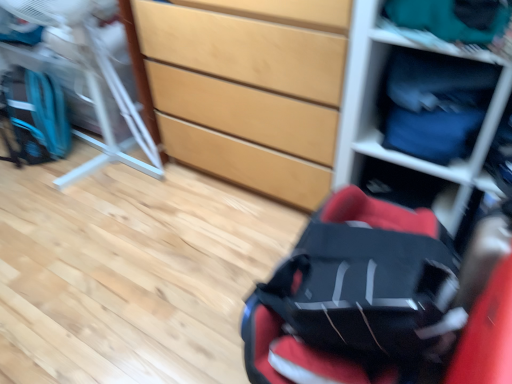
What is the approximate height of matte wood chest of drawers at center?

The height of matte wood chest of drawers at center is 84.53 centimeters.

Looking at this image, what is the approximate height of blue fabric drawer at upper right?

blue fabric drawer at upper right is 11.70 inches in height.

This screenshot has width=512, height=384. What do you see at coordinates (353, 296) in the screenshot? I see `red fabric baby carriage at center` at bounding box center [353, 296].

At what (x,y) coordinates should I click in order to perform the action: click on matte wood chest of drawers at center. Please return your answer as a coordinate pair (x, y). The image size is (512, 384). Looking at the image, I should click on (248, 92).

Considering the points (21, 12) and (351, 191), which point is behind, point (21, 12) or point (351, 191)?

The point (21, 12) is farther.

Is metallic silver folding chair at left with red fabric baby carriage at center?

No, metallic silver folding chair at left is not touching red fabric baby carriage at center.

Find the location of a particular element. baby carriage below the metallic silver folding chair at left (from the image's perspective) is located at coordinates (353, 296).

Which is in front, point (459, 21) or point (471, 170)?

The point (459, 21) is closer to the camera.

Can you confirm if teal fabric at upper right is shorter than blue fabric drawer at upper right?

Yes.

From a real-world perspective, who is located lower, teal fabric at upper right or blue fabric drawer at upper right?

blue fabric drawer at upper right is physically lower.

Is teal fabric at upper right positioned far away from blue fabric drawer at upper right?

No, there isn't a large distance between teal fabric at upper right and blue fabric drawer at upper right.

From a real-world perspective, which object stands above the other?

From a 3D spatial view, metallic silver folding chair at left is above.

Consider the image. Considering the sizes of objects red fabric baby carriage at center and metallic silver folding chair at left in the image provided, who is wider, red fabric baby carriage at center or metallic silver folding chair at left?

metallic silver folding chair at left is wider.

Is red fabric baby carriage at center directly adjacent to metallic silver folding chair at left?

No, red fabric baby carriage at center is not next to metallic silver folding chair at left.

How many degrees apart are the facing directions of matte plastic shelf at upper right and matte wood chest of drawers at center?

There is a 0.000946-degree angle between the facing directions of matte plastic shelf at upper right and matte wood chest of drawers at center.

From the image's perspective, between matte plastic shelf at upper right and matte wood chest of drawers at center, which one is located above?

matte wood chest of drawers at center is shown above in the image.

From a real-world perspective, is matte plastic shelf at upper right above or below matte wood chest of drawers at center?

In terms of real-world spatial position, matte plastic shelf at upper right is above matte wood chest of drawers at center.

Considering the positions of objects matte plastic shelf at upper right and matte wood chest of drawers at center in the image provided, who is behind, matte plastic shelf at upper right or matte wood chest of drawers at center?

Positioned behind is matte wood chest of drawers at center.

Is there a large distance between teal fabric at upper right and metallic silver folding chair at left?

Absolutely, teal fabric at upper right is distant from metallic silver folding chair at left.

Based on the photo, relative to metallic silver folding chair at left, is teal fabric at upper right in front or behind?

Visually, teal fabric at upper right is located in front of metallic silver folding chair at left.

Could you tell me if teal fabric at upper right is turned towards metallic silver folding chair at left?

No, teal fabric at upper right is not oriented towards metallic silver folding chair at left.

Based on their sizes in the image, would you say teal fabric at upper right is bigger or smaller than metallic silver folding chair at left?

In the image, teal fabric at upper right appears to be smaller than metallic silver folding chair at left.

Which of these two, blue fabric drawer at upper right or matte plastic shelf at upper right, is wider?

matte plastic shelf at upper right.

Considering the sizes of objects blue fabric drawer at upper right and matte plastic shelf at upper right in the image provided, who is bigger, blue fabric drawer at upper right or matte plastic shelf at upper right?

matte plastic shelf at upper right.

Looking at this image, from the image's perspective, which one is positioned higher, blue fabric drawer at upper right or matte plastic shelf at upper right?

From the image's view, blue fabric drawer at upper right is above.

From a real-world perspective, is blue fabric drawer at upper right above or below matte plastic shelf at upper right?

Clearly, from a real-world perspective, blue fabric drawer at upper right is above matte plastic shelf at upper right.

Looking at this image, from the image's perspective, is matte plastic shelf at upper right under teal fabric at upper right?

Correct, matte plastic shelf at upper right appears lower than teal fabric at upper right in the image.

How far apart are matte plastic shelf at upper right and teal fabric at upper right?

matte plastic shelf at upper right and teal fabric at upper right are 24.79 centimeters apart.

Would you consider matte plastic shelf at upper right to be distant from teal fabric at upper right?

matte plastic shelf at upper right is actually quite close to teal fabric at upper right.

This screenshot has height=384, width=512. What are the coordinates of `shelf that is below the teal fabric at upper right (from the image's perspective)` in the screenshot? It's located at (376, 116).

At what (x,y) coordinates should I click in order to perform the action: click on folding chair behind the red fabric baby carriage at center. Please return your answer as a coordinate pair (x, y). Image resolution: width=512 pixels, height=384 pixels. Looking at the image, I should click on (92, 81).

Image resolution: width=512 pixels, height=384 pixels. In order to click on clothing that appears in front of the blue fabric drawer at upper right in this screenshot , I will do `click(444, 20)`.

From the image, which object appears to be nearer to matte wood chest of drawers at center, red fabric baby carriage at center or teal fabric at upper right?

teal fabric at upper right.

Based on their spatial positions, is teal fabric at upper right or matte wood chest of drawers at center further from metallic silver folding chair at left?

The object further to metallic silver folding chair at left is teal fabric at upper right.

From the picture: Based on their spatial positions, is matte wood chest of drawers at center or matte plastic shelf at upper right closer to teal fabric at upper right?

matte plastic shelf at upper right is closer to teal fabric at upper right.

Estimate the real-world distances between objects in this image. Which object is closer to matte wood chest of drawers at center, metallic silver folding chair at left or matte plastic shelf at upper right?

Among the two, matte plastic shelf at upper right is located nearer to matte wood chest of drawers at center.

Looking at the image, which one is located closer to metallic silver folding chair at left, matte plastic shelf at upper right or blue fabric drawer at upper right?

matte plastic shelf at upper right lies closer to metallic silver folding chair at left than the other object.

When comparing their distances from teal fabric at upper right, does blue fabric drawer at upper right or red fabric baby carriage at center seem further?

Based on the image, red fabric baby carriage at center appears to be further to teal fabric at upper right.

From the image, which object appears to be farther from matte wood chest of drawers at center, matte plastic shelf at upper right or teal fabric at upper right?

teal fabric at upper right.

Looking at the image, which one is located further to red fabric baby carriage at center, blue fabric drawer at upper right or matte wood chest of drawers at center?

matte wood chest of drawers at center is positioned further to the anchor red fabric baby carriage at center.

Where is `chest of drawers between teal fabric at upper right and red fabric baby carriage at center from top to bottom`? This screenshot has width=512, height=384. chest of drawers between teal fabric at upper right and red fabric baby carriage at center from top to bottom is located at coordinates (248, 92).

Locate an element on the screen. Image resolution: width=512 pixels, height=384 pixels. drawer situated between metallic silver folding chair at left and teal fabric at upper right from left to right is located at coordinates (452, 162).

Locate an element on the screen. the chest of drawers situated between metallic silver folding chair at left and teal fabric at upper right from left to right is located at coordinates (248, 92).

Image resolution: width=512 pixels, height=384 pixels. I want to click on chest of drawers between metallic silver folding chair at left and red fabric baby carriage at center from left to right, so click(248, 92).